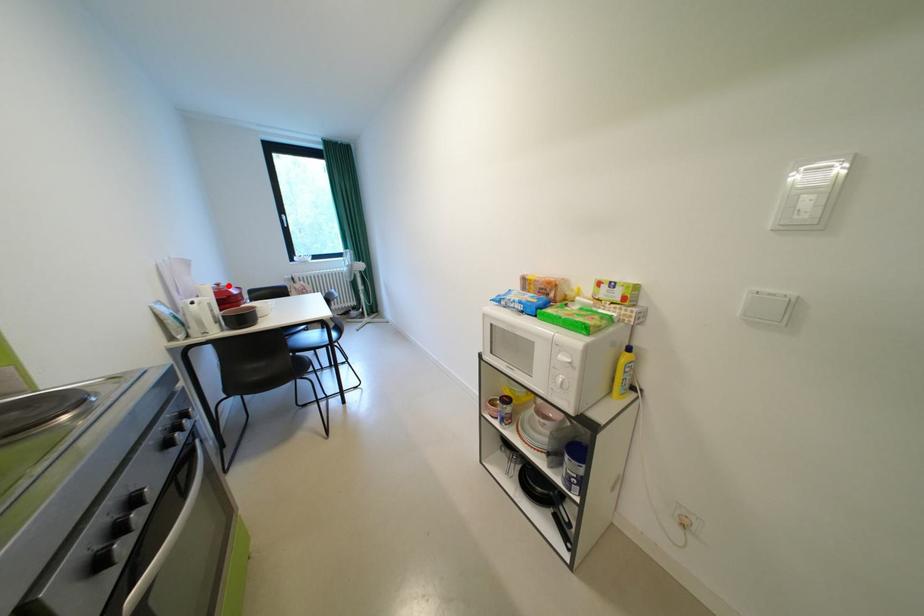
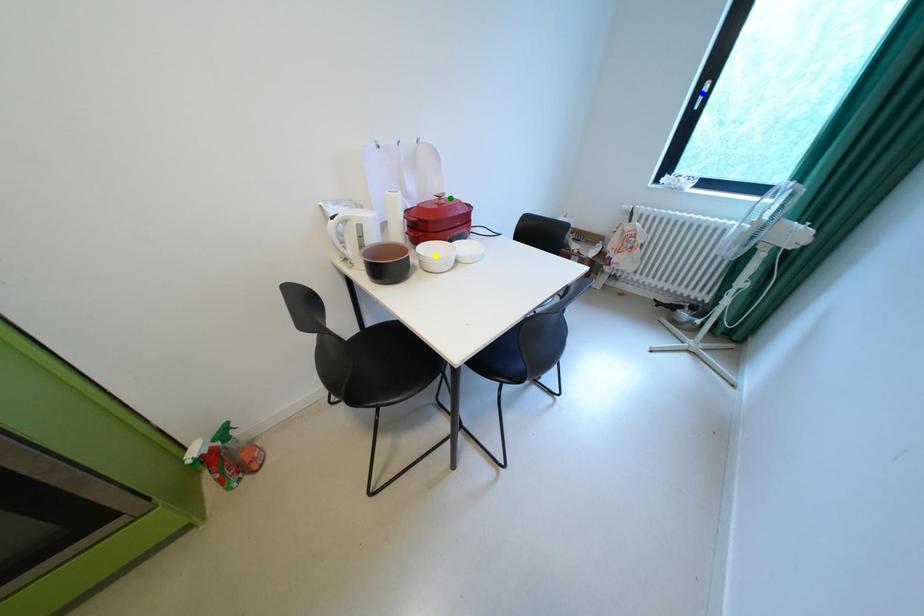
Question: I am providing you with two images of the same scene from different viewpoints. A red point is marked on the first image. You are given multiple points on the second image. Which spot in image 2 lines up with the point in image 1?

Choices:
 (A) yellow point
 (B) blue point
 (C) green point

Answer: (C)